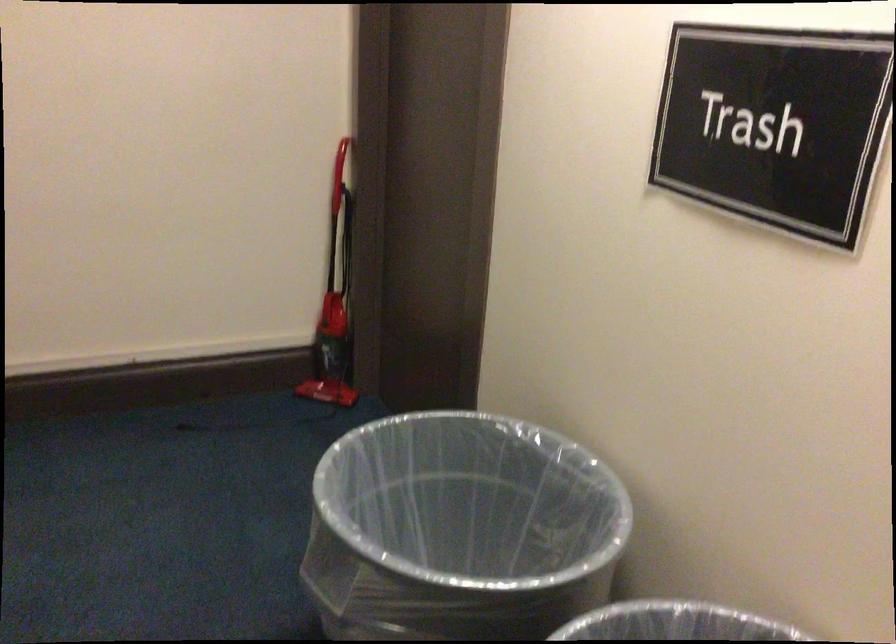
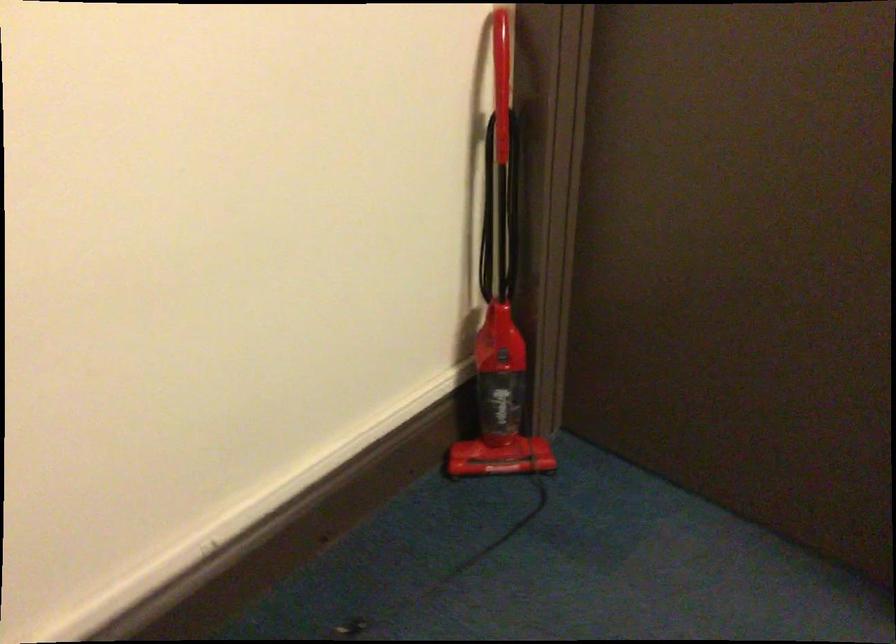
Where in the second image is the point corresponding to [336,162] from the first image?

(501, 78)